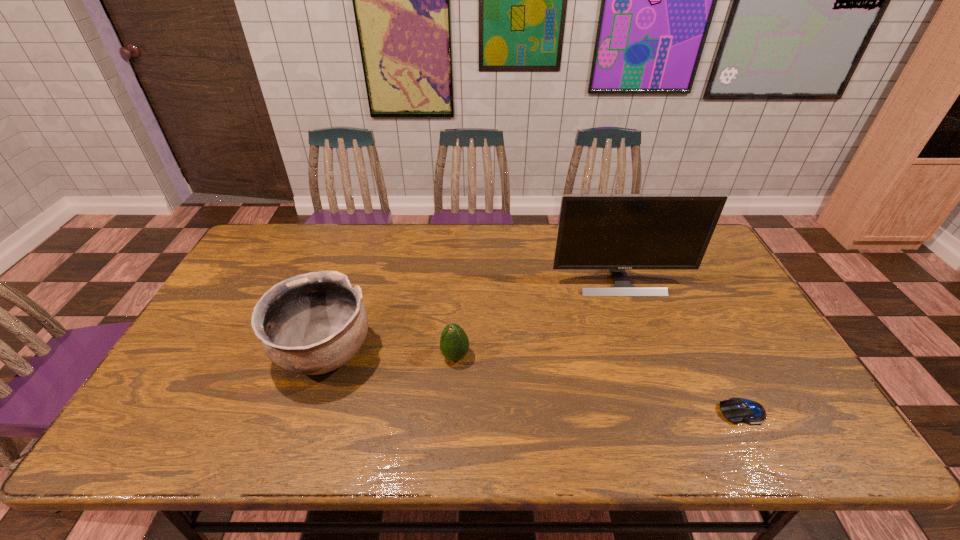
This screenshot has height=540, width=960. Find the location of `vacant area located 0.150m on the front of the avocado`. vacant area located 0.150m on the front of the avocado is located at coordinates (452, 421).

Identify the location of vacant area located on the button side of the shortest object. (612, 411).

The image size is (960, 540). In order to click on free space located on the button side of the shortest object in this screenshot , I will do `click(617, 411)`.

Where is `vacant space located 0.220m on the button side of the shortest object`? This screenshot has height=540, width=960. vacant space located 0.220m on the button side of the shortest object is located at coordinates [626, 411].

Find the location of a particular element. This screenshot has width=960, height=540. object that is at the near edge is located at coordinates (736, 410).

Image resolution: width=960 pixels, height=540 pixels. I want to click on monitor positioned at the right edge, so click(x=616, y=232).

This screenshot has height=540, width=960. I want to click on computer mouse at the right edge, so click(736, 410).

At what (x,y) coordinates should I click in order to perform the action: click on object present at the near right corner. Please return your answer as a coordinate pair (x, y). Image resolution: width=960 pixels, height=540 pixels. Looking at the image, I should click on (736, 410).

In the image, there is a desktop. In order to click on vacant space at the far edge in this screenshot , I will do `click(501, 252)`.

In order to click on free space at the near edge of the desktop in this screenshot , I will do `click(299, 444)`.